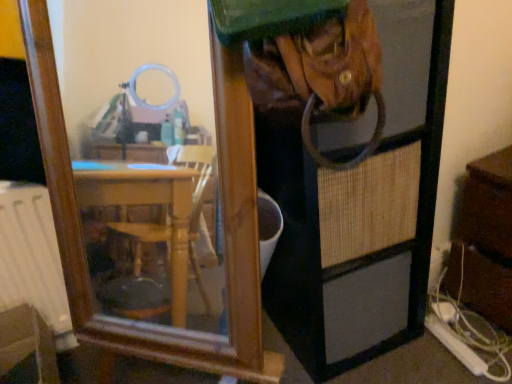
Question: Can you confirm if brown wooden dresser at right is positioned to the right of brushed metal water at lower left?

Choices:
 (A) no
 (B) yes

Answer: (B)

Question: Is brown wooden dresser at right at the left side of brushed metal water at lower left?

Choices:
 (A) no
 (B) yes

Answer: (A)

Question: Is brown wooden dresser at right surrounding brushed metal water at lower left?

Choices:
 (A) no
 (B) yes

Answer: (A)

Question: Can you confirm if brown wooden dresser at right is thinner than brushed metal water at lower left?

Choices:
 (A) no
 (B) yes

Answer: (A)

Question: Is brown wooden dresser at right in contact with brushed metal water at lower left?

Choices:
 (A) yes
 (B) no

Answer: (B)

Question: From the image's perspective, is brown wooden dresser at right on top of brushed metal water at lower left?

Choices:
 (A) yes
 (B) no

Answer: (A)

Question: Does brushed metal water at lower left lie behind brown wooden dresser at right?

Choices:
 (A) no
 (B) yes

Answer: (A)

Question: Is brushed metal water at lower left smaller than brown wooden dresser at right?

Choices:
 (A) yes
 (B) no

Answer: (A)

Question: Is brushed metal water at lower left positioned beyond the bounds of brown wooden dresser at right?

Choices:
 (A) no
 (B) yes

Answer: (B)

Question: From the image's perspective, is brushed metal water at lower left on top of brown wooden dresser at right?

Choices:
 (A) no
 (B) yes

Answer: (A)

Question: From the image's perspective, is brushed metal water at lower left located beneath brown wooden dresser at right?

Choices:
 (A) yes
 (B) no

Answer: (A)

Question: Does brushed metal water at lower left have a greater height compared to brown wooden dresser at right?

Choices:
 (A) no
 (B) yes

Answer: (A)

Question: Would you consider brown wooden dresser at right to be distant from brown woven screen door at center?

Choices:
 (A) yes
 (B) no

Answer: (B)